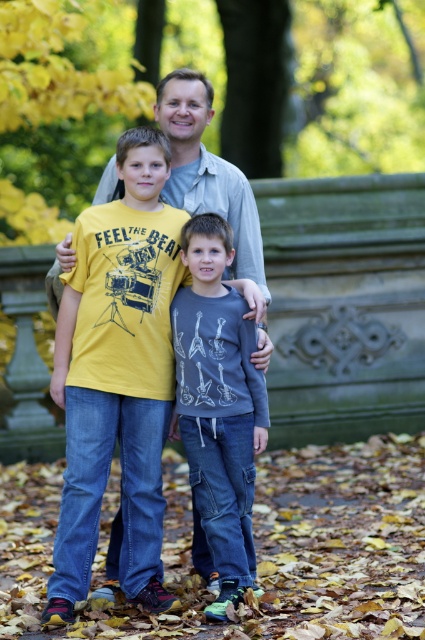
Question: Can you confirm if yellow cotton t-shirt at center is wider than dark gray cotton shirt at center?

Choices:
 (A) yes
 (B) no

Answer: (A)

Question: Does yellow cotton t-shirt at center have a smaller size compared to dark gray cotton shirt at center?

Choices:
 (A) yes
 (B) no

Answer: (B)

Question: Which object appears farthest from the camera in this image?

Choices:
 (A) yellow cotton t-shirt at center
 (B) dark gray cotton shirt at center

Answer: (B)

Question: Is yellow cotton t-shirt at center below dark gray cotton shirt at center?

Choices:
 (A) no
 (B) yes

Answer: (A)